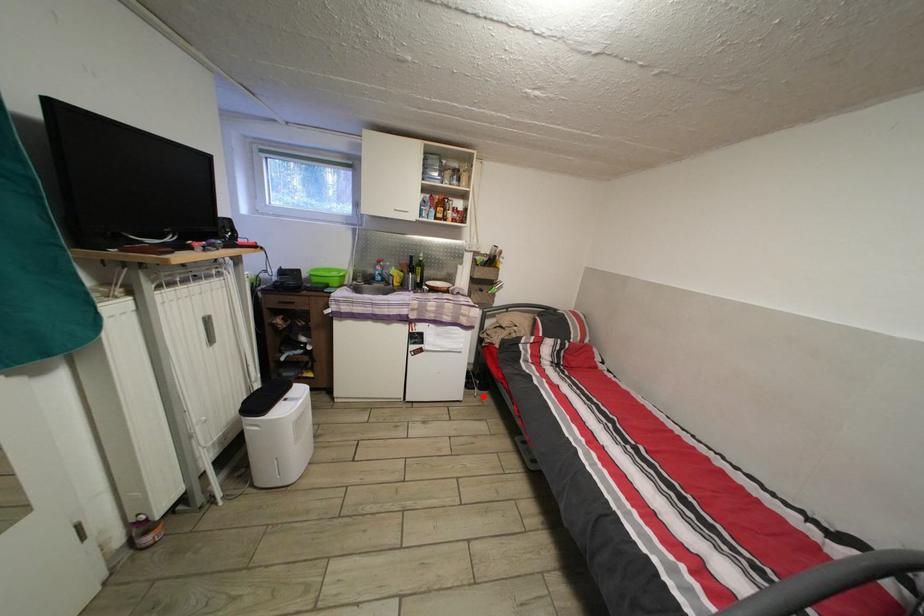
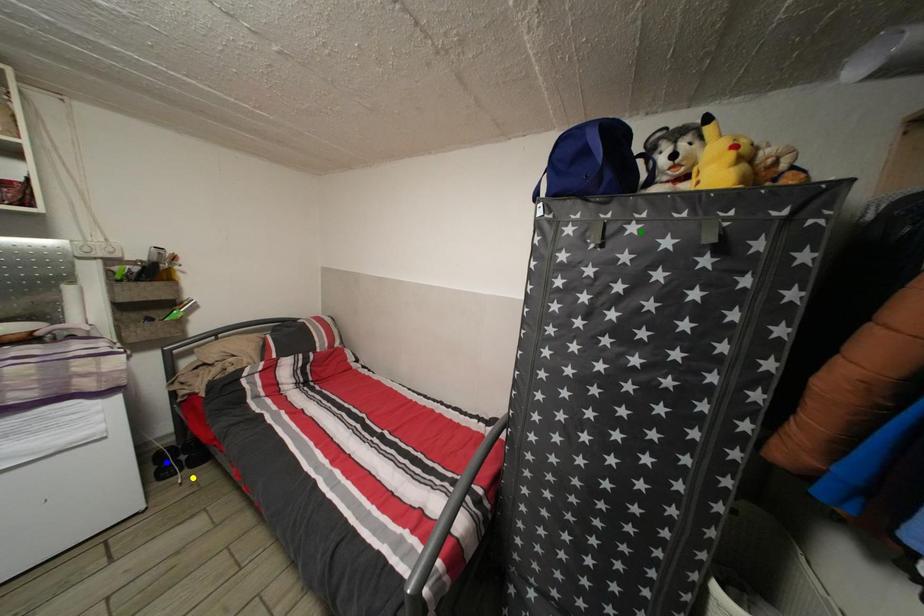
Question: I am providing you with two images of the same scene from different viewpoints. A red point is marked on the first image. You are given multiple points on the second image. Can you choose the point in image 2 that corresponds to the point in image 1?

Choices:
 (A) green point
 (B) blue point
 (C) yellow point

Answer: (C)